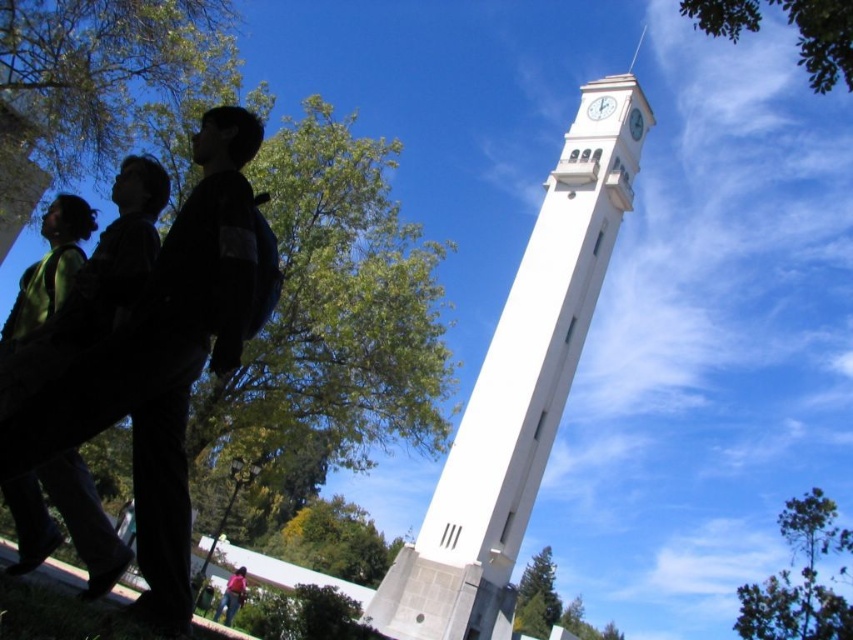
Question: Does white concrete clock tower at center have a larger size compared to white glossy clock at upper center?

Choices:
 (A) no
 (B) yes

Answer: (B)

Question: Based on their relative distances, which object is farther from the pink fabric pants at lower center?

Choices:
 (A) white smooth clock at upper center
 (B) white concrete clock tower at center

Answer: (A)

Question: From the image, what is the correct spatial relationship of pink fabric pants at lower center in relation to white glossy clock at upper center?

Choices:
 (A) above
 (B) below

Answer: (B)

Question: Does pink fabric pants at lower center have a lesser width compared to white smooth clock at upper center?

Choices:
 (A) no
 (B) yes

Answer: (A)

Question: Considering the real-world distances, which object is farthest from the white smooth clock at upper center?

Choices:
 (A) white concrete clock tower at center
 (B) white glossy clock at upper center
 (C) pink fabric pants at lower center

Answer: (C)

Question: Which point is farther to the camera?

Choices:
 (A) (635, 125)
 (B) (601, 99)
 (C) (230, 621)

Answer: (B)